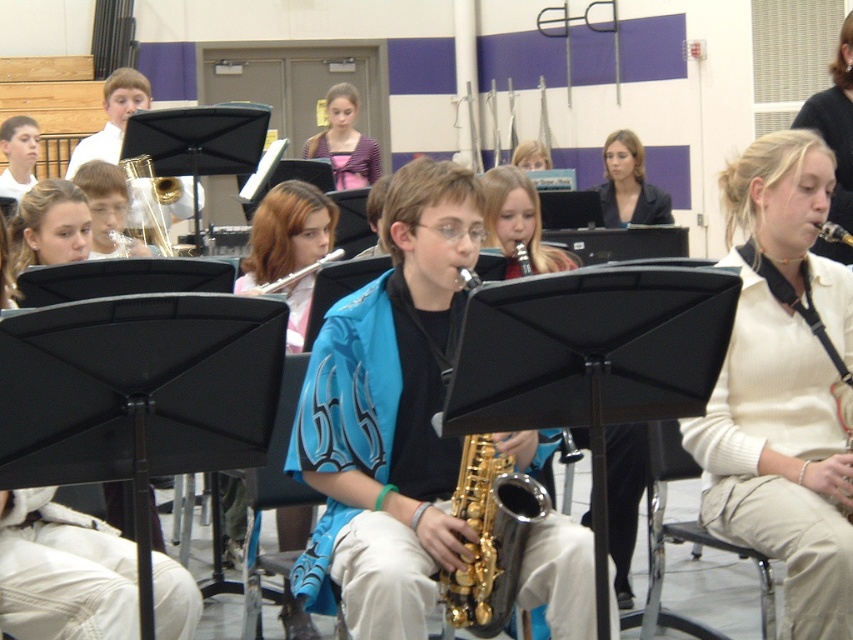
Between purple satin dress at center and gold metallic saxophone at center, which one appears on the left side from the viewer's perspective?

purple satin dress at center

Is purple satin dress at center further to the viewer compared to gold metallic saxophone at center?

Yes, it is behind gold metallic saxophone at center.

At what (x,y) coordinates should I click in order to perform the action: click on purple satin dress at center. Please return your answer as a coordinate pair (x, y). The width and height of the screenshot is (853, 640). Looking at the image, I should click on (344, 141).

Locate an element on the screen. The height and width of the screenshot is (640, 853). purple satin dress at center is located at coordinates (344, 141).

Can you confirm if white sweater at center is positioned above blonde hair at upper right?

No.

Does white sweater at center have a smaller size compared to blonde hair at upper right?

No, white sweater at center is not smaller than blonde hair at upper right.

Is point (805, 394) farther from camera compared to point (815, 243)?

No, it is in front of (815, 243).

At what (x,y) coordinates should I click in order to perform the action: click on white sweater at center. Please return your answer as a coordinate pair (x, y). Looking at the image, I should click on (784, 387).

Is matte blue jacket at center further to the viewer compared to smooth pink sweater at center?

No, it is in front of smooth pink sweater at center.

Who is more distant from viewer, (15, 163) or (535, 156)?

Positioned behind is point (15, 163).

Locate an element on the screen. matte blue jacket at center is located at coordinates (18, 154).